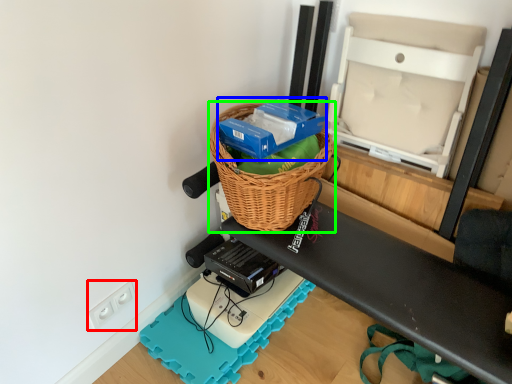
Question: Considering the real-world distances, which object is closest to electric outlet (highlighted by a red box)? box (highlighted by a blue box) or picnic basket (highlighted by a green box).

Choices:
 (A) box
 (B) picnic basket

Answer: (B)